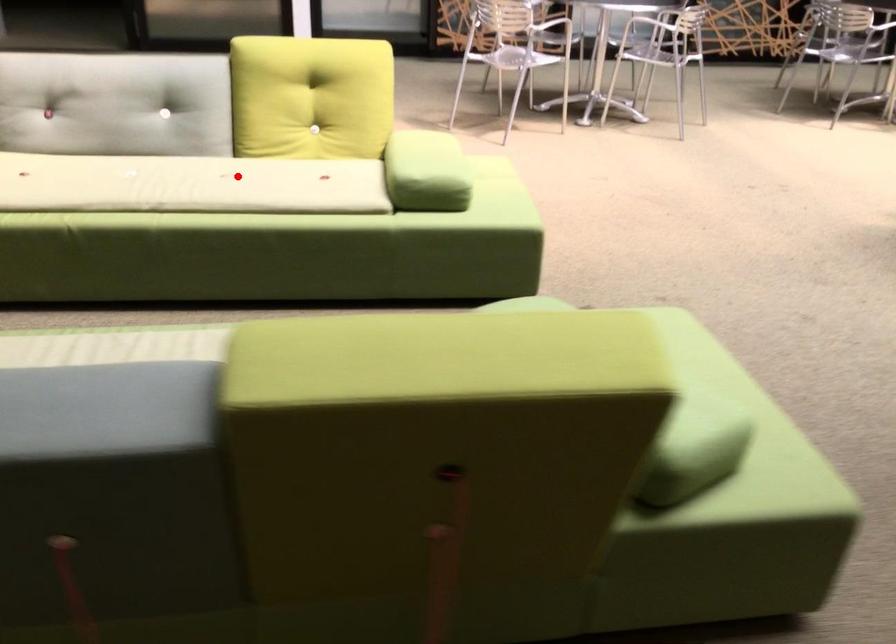
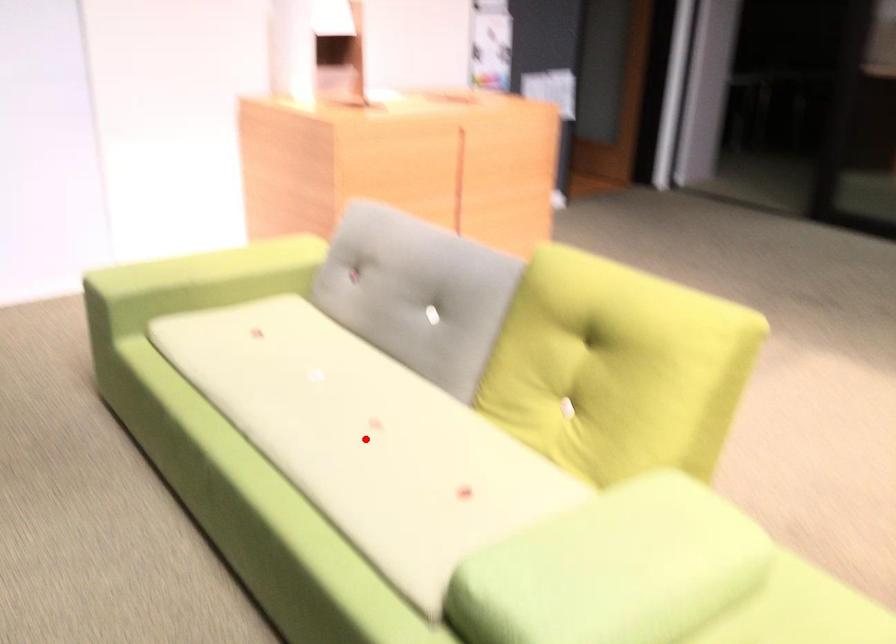
I am providing you with two images of the same scene from different viewpoints. A red point is marked on the first image and another point is marked on the second image. Is the red point in image1 aligned with the point shown in image2?

Yes